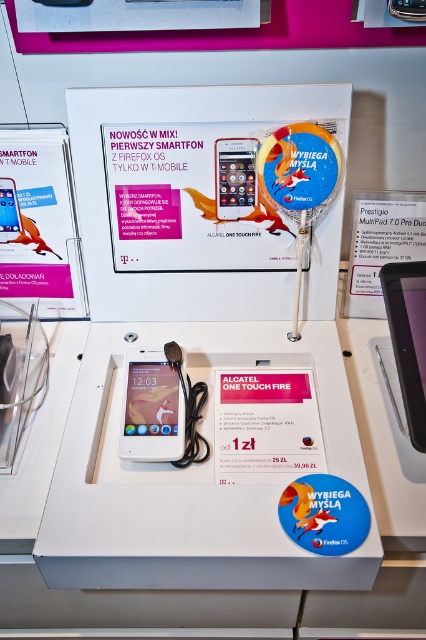
Find the location of a particular element. white glossy ipod at center is located at coordinates (150, 406).

Is white glossy ipod at center to the right of matte white ipod touch at center from the viewer's perspective?

In fact, white glossy ipod at center is to the left of matte white ipod touch at center.

This screenshot has width=426, height=640. I want to click on white glossy ipod at center, so click(x=150, y=406).

Who is more forward, (396, 276) or (226, 172)?

Point (396, 276)

Does black glossy tablet at upper right appear under matte white ipod touch at center?

Yes.

Is point (388, 300) closer to viewer compared to point (244, 188)?

Yes, point (388, 300) is closer to viewer.

Where is `black glossy tablet at upper right`? black glossy tablet at upper right is located at coordinates (408, 339).

Who is higher up, white glossy ipod at center or black glossy tablet at upper right?

black glossy tablet at upper right is above.

Can you confirm if white glossy ipod at center is taller than black glossy tablet at upper right?

No, white glossy ipod at center is not taller than black glossy tablet at upper right.

What do you see at coordinates (150, 406) in the screenshot? I see `white glossy ipod at center` at bounding box center [150, 406].

Identify the location of white glossy ipod at center. The width and height of the screenshot is (426, 640). (150, 406).